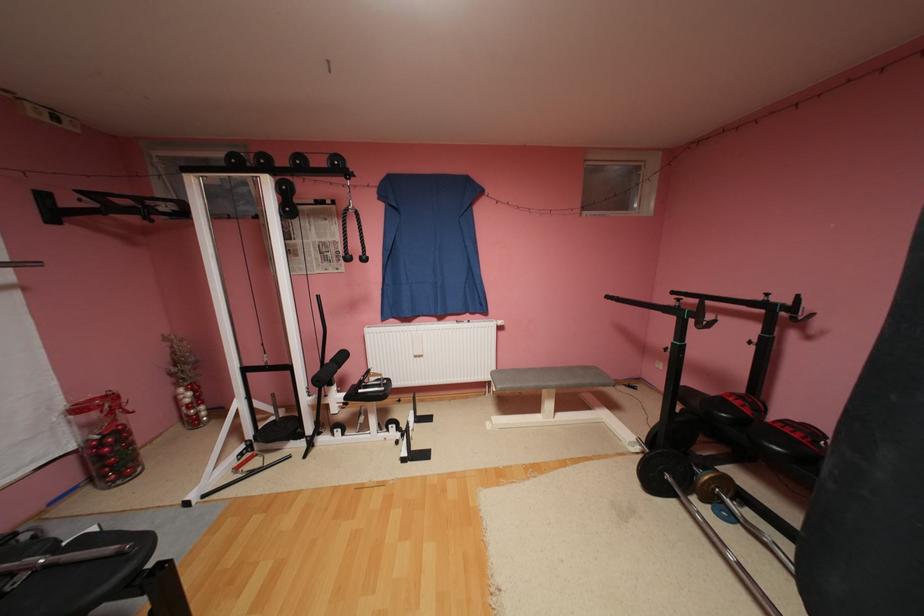
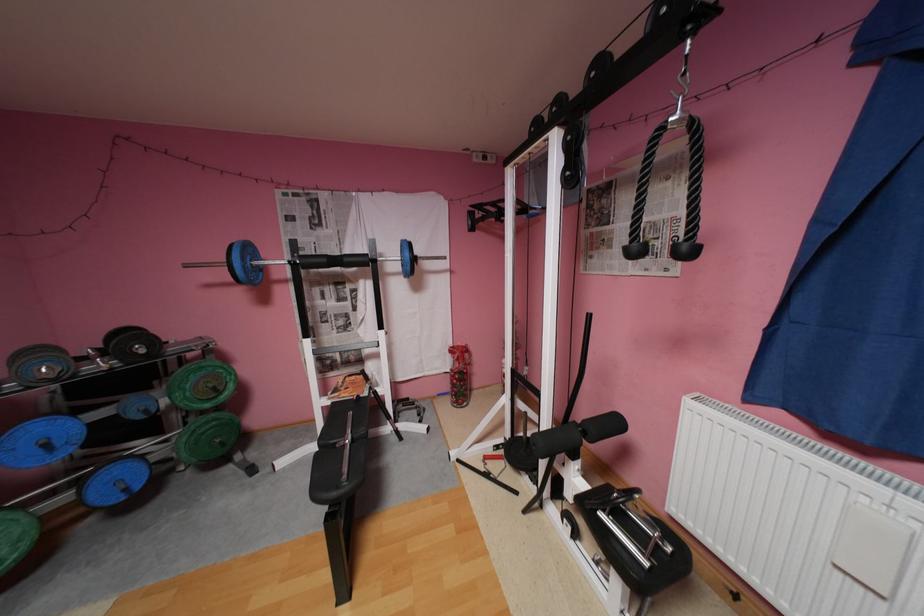
Where in the second image is the point corresponding to the point at 372,257 from the first image?

(695, 246)